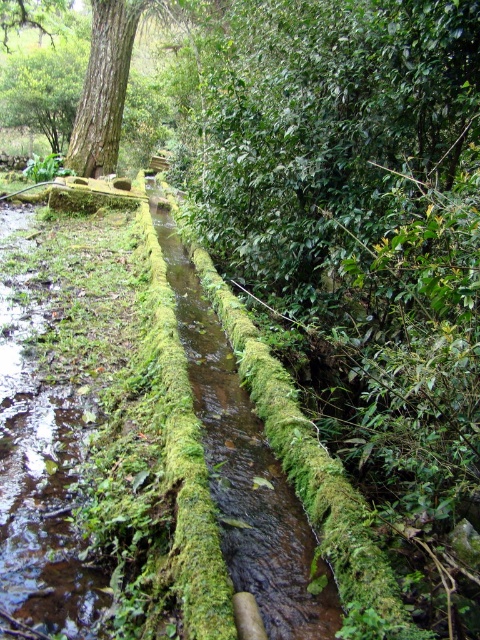
Question: Which object is closer to the camera taking this photo?

Choices:
 (A) green mossy water at center
 (B) brown rough tree trunk at upper left

Answer: (A)

Question: Which point appears closest to the camera in this image?

Choices:
 (A) 50,509
 (B) 124,10

Answer: (A)

Question: Observing the image, what is the correct spatial positioning of green mossy water at center in reference to brown rough tree trunk at upper left?

Choices:
 (A) below
 (B) above

Answer: (A)

Question: Does green mossy water at center appear on the right side of brown rough tree trunk at upper left?

Choices:
 (A) no
 (B) yes

Answer: (B)

Question: Is green mossy water at center below brown rough tree trunk at upper left?

Choices:
 (A) no
 (B) yes

Answer: (B)